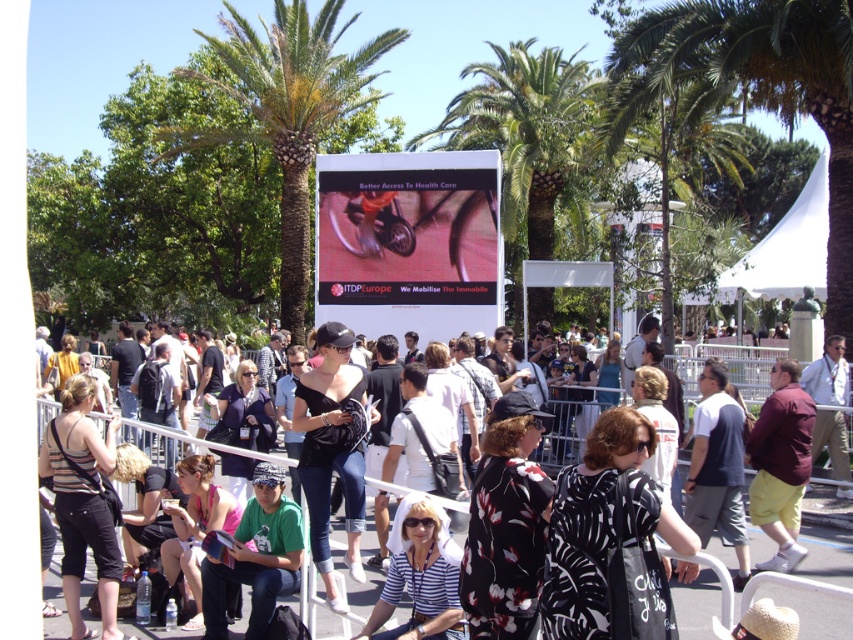
Can you confirm if green leafy palm tree at upper right is thinner than black matte dress at center?

Yes, green leafy palm tree at upper right is thinner than black matte dress at center.

Is green leafy palm tree at upper right further to the viewer compared to black matte dress at center?

Yes, green leafy palm tree at upper right is further from the viewer.

Is point (840, 280) less distant than point (358, 464)?

No, it is behind (358, 464).

Where is `green leafy palm tree at upper right`? The width and height of the screenshot is (853, 640). green leafy palm tree at upper right is located at coordinates (753, 88).

Can you confirm if black floral dress at center is positioned to the right of green fabric shirt at lower left?

Correct, you'll find black floral dress at center to the right of green fabric shirt at lower left.

How distant is black floral dress at center from green fabric shirt at lower left?

black floral dress at center and green fabric shirt at lower left are 9.24 feet apart from each other.

Who is more distant from viewer, (596, 529) or (276, 483)?

The point (276, 483) is behind.

Image resolution: width=853 pixels, height=640 pixels. I want to click on black floral dress at center, so click(x=610, y=540).

Does green leafy palm tree at upper right have a greater width compared to striped fabric tank top at center?

In fact, green leafy palm tree at upper right might be narrower than striped fabric tank top at center.

Does point (743, 72) come in front of point (76, 467)?

No, it is behind (76, 467).

Find the location of a particular element. green leafy palm tree at upper right is located at coordinates (753, 88).